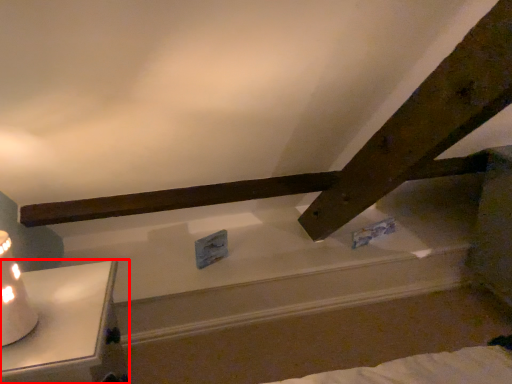
Question: From the image's perspective, what is the correct spatial relationship of furniture (annotated by the red box) in relation to table lamp?

Choices:
 (A) above
 (B) below

Answer: (B)